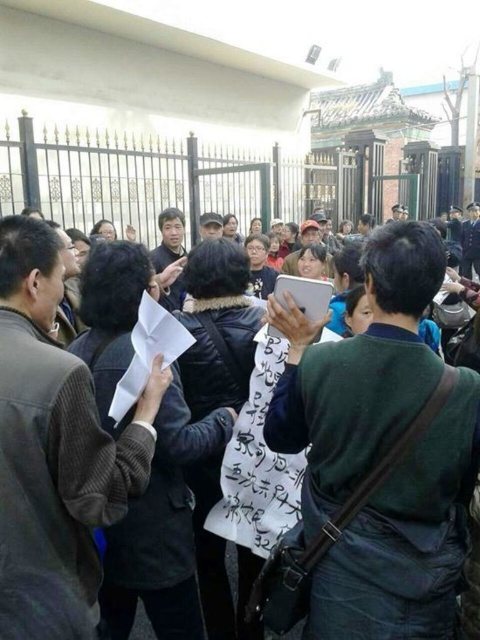
You are a photographer at the scene. You want to capture a photo that includes both the green fabric shirt at center and the white paper at center. Based on their positions, which object should you focus on first to ensure both are in frame?

Since the green fabric shirt at center is to the right of the white paper at center, you should focus on the white paper at center first to ensure both are in frame.

You are a photographer at the event and want to capture a clear shot of both the green fabric shirt at center and the white paper at center. Which object should you focus on first to ensure it appears larger in the photo?

The white paper at center occupies more space than the green fabric shirt at center, so you should focus on the white paper at center first to ensure it appears larger in the photo.